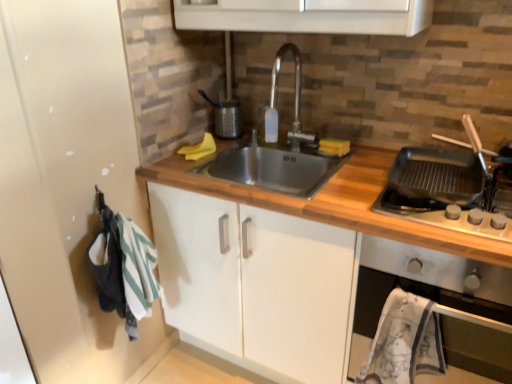
Question: Looking at the image, does metallic silver oven at right seem bigger or smaller compared to black matte griddle at right?

Choices:
 (A) big
 (B) small

Answer: (A)

Question: In terms of width, does metallic silver oven at right look wider or thinner when compared to black matte griddle at right?

Choices:
 (A) thin
 (B) wide

Answer: (B)

Question: Based on their relative distances, which object is nearer to the wooden at center?

Choices:
 (A) black matte griddle at right
 (B) metallic silver oven at right
 (C) stainless steel sink at center
 (D) satin nickel faucet at center

Answer: (C)

Question: Which is farther from the metallic silver oven at right?

Choices:
 (A) black matte griddle at right
 (B) stainless steel sink at center
 (C) satin nickel faucet at center
 (D) wooden at center

Answer: (C)